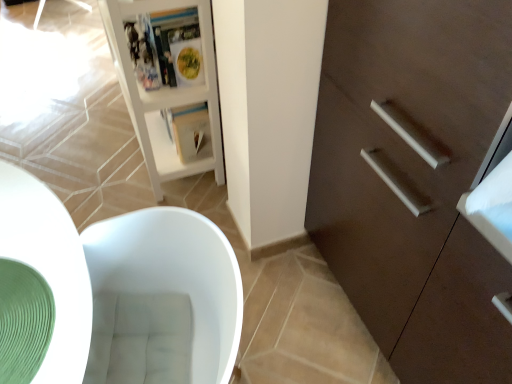
Locate an element on the screen. Image resolution: width=512 pixels, height=384 pixels. dark brown wood cabinet at right is located at coordinates (413, 179).

This screenshot has height=384, width=512. In order to click on matte plastic magazine at upper center, which is the 1th magazine from front to back in this screenshot , I will do `click(165, 48)`.

How much space does matte plastic magazine at upper center, which ranks as the 2th magazine in back-to-front order, occupy vertically?

The height of matte plastic magazine at upper center, which ranks as the 2th magazine in back-to-front order, is 10.02 inches.

At what (x,y) coordinates should I click in order to perform the action: click on dark brown wood cabinet at right. Please return your answer as a coordinate pair (x, y). Looking at the image, I should click on [413, 179].

Is white glossy bookshelf at upper left positioned beyond the bounds of dark brown wood cabinet at right?

Yes, white glossy bookshelf at upper left is not within dark brown wood cabinet at right.

Find the location of a particular element. The height and width of the screenshot is (384, 512). cabinetry above the white glossy bookshelf at upper left (from a real-world perspective) is located at coordinates [x=413, y=179].

In terms of width, does white glossy bookshelf at upper left look wider or thinner when compared to dark brown wood cabinet at right?

Considering their sizes, white glossy bookshelf at upper left looks slimmer than dark brown wood cabinet at right.

From the image's perspective, between white glossy bookshelf at upper left and matte plastic magazine at upper center, which ranks as the 2th magazine in back-to-front order, who is located below?

matte plastic magazine at upper center, which ranks as the 2th magazine in back-to-front order, is shown below in the image.

From a real-world perspective, is white glossy bookshelf at upper left on matte plastic magazine at upper center, which ranks as the 2th magazine in back-to-front order?

No.

Is white glossy bookshelf at upper left taller or shorter than matte plastic magazine at upper center, which ranks as the 2th magazine in back-to-front order?

white glossy bookshelf at upper left is taller than matte plastic magazine at upper center, which ranks as the 2th magazine in back-to-front order.

Could you tell me if white glossy bookshelf at upper left is facing matte plastic magazine at upper center, which ranks as the 2th magazine in back-to-front order?

Yes, white glossy bookshelf at upper left is oriented towards matte plastic magazine at upper center, which ranks as the 2th magazine in back-to-front order.

From a real-world perspective, between white glossy bookshelf at upper left and green rubber mat at lower left, who is vertically lower?

white glossy bookshelf at upper left is physically lower.

Does point (112, 32) come behind point (28, 214)?

Yes, it is behind point (28, 214).

Consider the image. Is white glossy bookshelf at upper left turned away from green rubber mat at lower left?

No.

Can you confirm if white glossy bookshelf at upper left is shorter than green rubber mat at lower left?

In fact, white glossy bookshelf at upper left may be taller than green rubber mat at lower left.

From the picture: Is green rubber mat at lower left bigger than matte plastic magazine at upper center, which is the 1th magazine from front to back?

No.

Is green rubber mat at lower left far away from matte plastic magazine at upper center, which is the 1th magazine from front to back?

No, green rubber mat at lower left is not far away from matte plastic magazine at upper center, which is the 1th magazine from front to back.

Considering the sizes of green rubber mat at lower left and matte plastic magazine at upper center, which is the 1th magazine from front to back, in the image, is green rubber mat at lower left wider or thinner than matte plastic magazine at upper center, which is the 1th magazine from front to back,?

Clearly, green rubber mat at lower left has more width compared to matte plastic magazine at upper center, which is the 1th magazine from front to back.

How different are the orientations of green rubber mat at lower left and matte plastic magazine at upper center, which is the 1th magazine from front to back, in degrees?

139 degrees separate the facing orientations of green rubber mat at lower left and matte plastic magazine at upper center, which is the 1th magazine from front to back.

Is matte plastic magazine at upper center, which is the 1th magazine from front to back, touching white paper magazine at center, the second magazine positioned from the front?

No, matte plastic magazine at upper center, which is the 1th magazine from front to back, is not in contact with white paper magazine at center, the second magazine positioned from the front.

Considering the positions of points (158, 26) and (186, 120), is point (158, 26) closer to camera compared to point (186, 120)?

Yes, it is.

Between matte plastic magazine at upper center, which is the 1th magazine from front to back, and white paper magazine at center, which ranks as the 1th magazine in back-to-front order, which one has less height?

With less height is white paper magazine at center, which ranks as the 1th magazine in back-to-front order.

Measure the distance from matte plastic magazine at upper center, which ranks as the 2th magazine in back-to-front order, to white paper magazine at center, which ranks as the 1th magazine in back-to-front order.

matte plastic magazine at upper center, which ranks as the 2th magazine in back-to-front order, and white paper magazine at center, which ranks as the 1th magazine in back-to-front order, are 24.31 centimeters apart from each other.

This screenshot has width=512, height=384. Find the location of `magazine that is on the left side of matte plastic magazine at upper center, which ranks as the 2th magazine in back-to-front order`. magazine that is on the left side of matte plastic magazine at upper center, which ranks as the 2th magazine in back-to-front order is located at coordinates (188, 129).

From the image's perspective, which one is positioned lower, white paper magazine at center, which ranks as the 1th magazine in back-to-front order, or matte plastic magazine at upper center, which ranks as the 2th magazine in back-to-front order?

white paper magazine at center, which ranks as the 1th magazine in back-to-front order, from the image's perspective.

From a real-world perspective, which object stands above the other?

From a 3D spatial view, matte plastic magazine at upper center, which ranks as the 2th magazine in back-to-front order, is above.

Who is more distant, dark brown wood cabinet at right or white paper magazine at center, which ranks as the 1th magazine in back-to-front order?

Positioned behind is white paper magazine at center, which ranks as the 1th magazine in back-to-front order.

Between dark brown wood cabinet at right and white paper magazine at center, the second magazine positioned from the front, which one has less height?

With less height is white paper magazine at center, the second magazine positioned from the front.

Image resolution: width=512 pixels, height=384 pixels. I want to click on the 2nd magazine behind the dark brown wood cabinet at right, so click(188, 129).

This screenshot has height=384, width=512. Find the location of `cabinetry located on the right of white glossy bookshelf at upper left`. cabinetry located on the right of white glossy bookshelf at upper left is located at coordinates (413, 179).

I want to click on cupboard that is above the matte plastic magazine at upper center, which is the 1th magazine from front to back (from the image's perspective), so click(165, 93).

Looking at this image, looking at the image, which one is located further to white glossy bookshelf at upper left, dark brown wood cabinet at right or green rubber mat at lower left?

green rubber mat at lower left.

Based on their spatial positions, is white paper magazine at center, the second magazine positioned from the front, or green rubber mat at lower left closer to white glossy bookshelf at upper left?

white paper magazine at center, the second magazine positioned from the front, is positioned closer to the anchor white glossy bookshelf at upper left.

In the scene shown: When comparing their distances from green rubber mat at lower left, does white glossy bookshelf at upper left or dark brown wood cabinet at right seem further?

Based on the image, white glossy bookshelf at upper left appears to be further to green rubber mat at lower left.

From the image, which object appears to be farther from white paper magazine at center, the second magazine positioned from the front, dark brown wood cabinet at right or white glossy bookshelf at upper left?

Among the two, dark brown wood cabinet at right is located further to white paper magazine at center, the second magazine positioned from the front.

Estimate the real-world distances between objects in this image. Which object is further from green rubber mat at lower left, white glossy bookshelf at upper left or white paper magazine at center, which ranks as the 1th magazine in back-to-front order?

The object further to green rubber mat at lower left is white paper magazine at center, which ranks as the 1th magazine in back-to-front order.

Consider the image. Looking at the image, which one is located further to white glossy bookshelf at upper left, white paper magazine at center, which ranks as the 1th magazine in back-to-front order, or matte plastic magazine at upper center, which ranks as the 2th magazine in back-to-front order?

Based on the image, white paper magazine at center, which ranks as the 1th magazine in back-to-front order, appears to be further to white glossy bookshelf at upper left.

When comparing their distances from green rubber mat at lower left, does dark brown wood cabinet at right or white paper magazine at center, the second magazine positioned from the front, seem further?

white paper magazine at center, the second magazine positioned from the front, is further to green rubber mat at lower left.

Based on their spatial positions, is white glossy bookshelf at upper left or green rubber mat at lower left further from dark brown wood cabinet at right?

white glossy bookshelf at upper left is further to dark brown wood cabinet at right.

Find the location of a particular element. The height and width of the screenshot is (384, 512). magazine located between dark brown wood cabinet at right and white paper magazine at center, the second magazine positioned from the front, in the depth direction is located at coordinates (165, 48).

This screenshot has height=384, width=512. Find the location of `magazine positioned between white glossy bookshelf at upper left and white paper magazine at center, the second magazine positioned from the front, from near to far`. magazine positioned between white glossy bookshelf at upper left and white paper magazine at center, the second magazine positioned from the front, from near to far is located at coordinates (165, 48).

The width and height of the screenshot is (512, 384). What are the coordinates of `cupboard between dark brown wood cabinet at right and white paper magazine at center, the second magazine positioned from the front, from front to back` in the screenshot? It's located at (165, 93).

Identify the location of round table located between white glossy bookshelf at upper left and dark brown wood cabinet at right in the left-right direction. This screenshot has height=384, width=512. (49, 267).